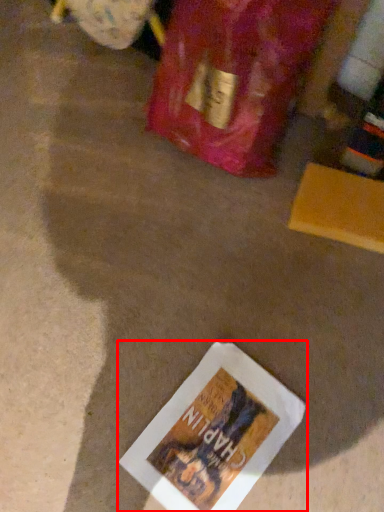
Question: From the image's perspective, considering the relative positions of book (annotated by the red box) and wine bottle in the image provided, where is book (annotated by the red box) located with respect to the staircase?

Choices:
 (A) above
 (B) below

Answer: (B)